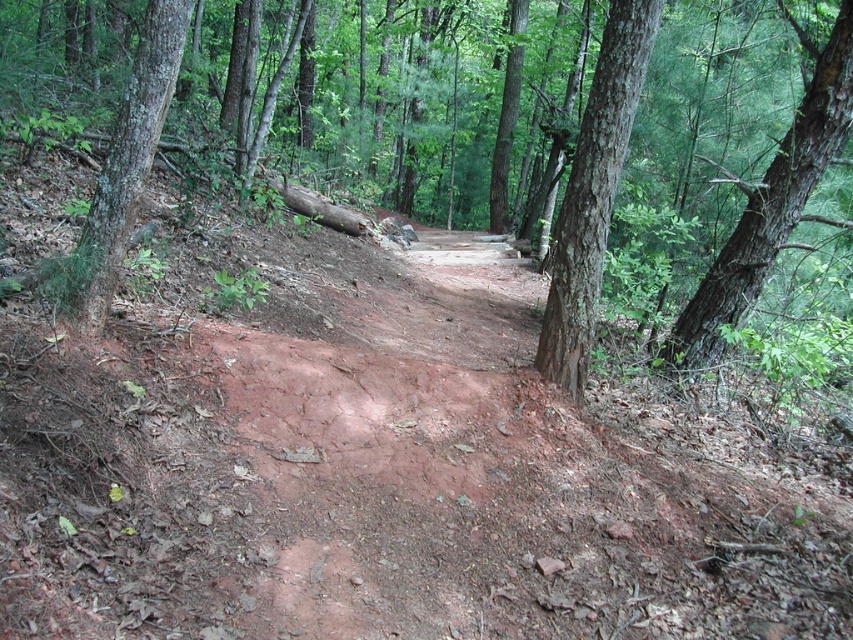
Does smooth bark tree at center come in front of brown rough bark tree at left?

No, it is not.

Can you confirm if smooth bark tree at center is wider than brown rough bark tree at left?

No, smooth bark tree at center is not wider than brown rough bark tree at left.

Is point (592, 186) positioned in front of point (154, 97)?

That is False.

You are a GUI agent. You are given a task and a screenshot of the screen. Output one action in this format:
    pyautogui.click(x=<x>, y=<y>)
    Task: Click on the smooth bark tree at center
    
    Given the screenshot: What is the action you would take?
    pyautogui.click(x=593, y=193)

Is brown rough tree at center positioned behind smooth bark tree at center?

No, it is in front of smooth bark tree at center.

What do you see at coordinates (579, 120) in the screenshot?
I see `brown rough tree at center` at bounding box center [579, 120].

You are a GUI agent. You are given a task and a screenshot of the screen. Output one action in this format:
    pyautogui.click(x=<x>, y=<y>)
    Task: Click on the brown rough tree at center
    The height and width of the screenshot is (640, 853).
    Given the screenshot: What is the action you would take?
    pyautogui.click(x=579, y=120)

Identify the location of brown rough tree at center. The height and width of the screenshot is (640, 853). (579, 120).

What do you see at coordinates (579, 120) in the screenshot?
I see `brown rough tree at center` at bounding box center [579, 120].

Is point (704, 147) less distant than point (840, 10)?

No, it is not.

Identify the location of brown rough tree at center. This screenshot has width=853, height=640. (579, 120).